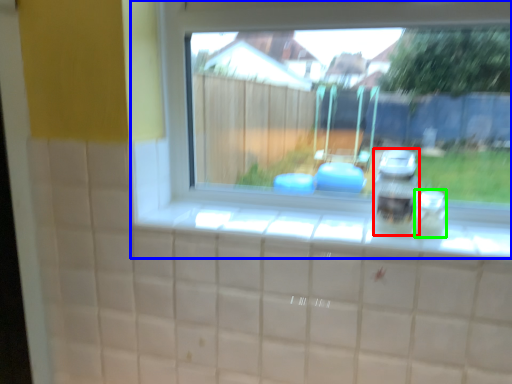
Question: Considering the real-world distances, which object is closest to appliance (highlighted by a red box)? window (highlighted by a blue box) or glass jar (highlighted by a green box).

Choices:
 (A) window
 (B) glass jar

Answer: (B)